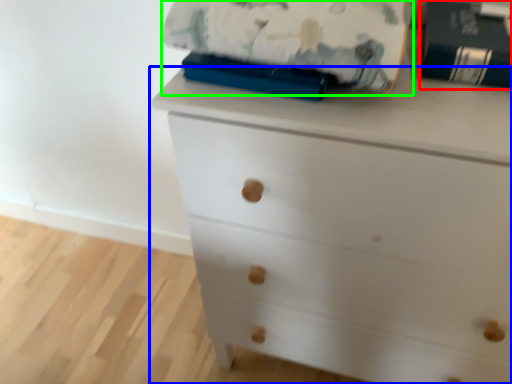
Question: Estimate the real-world distances between objects in this image. Which object is closer to paperback book (highlighted by a red box), chest of drawers (highlighted by a blue box) or blanket (highlighted by a green box)?

Choices:
 (A) chest of drawers
 (B) blanket

Answer: (B)